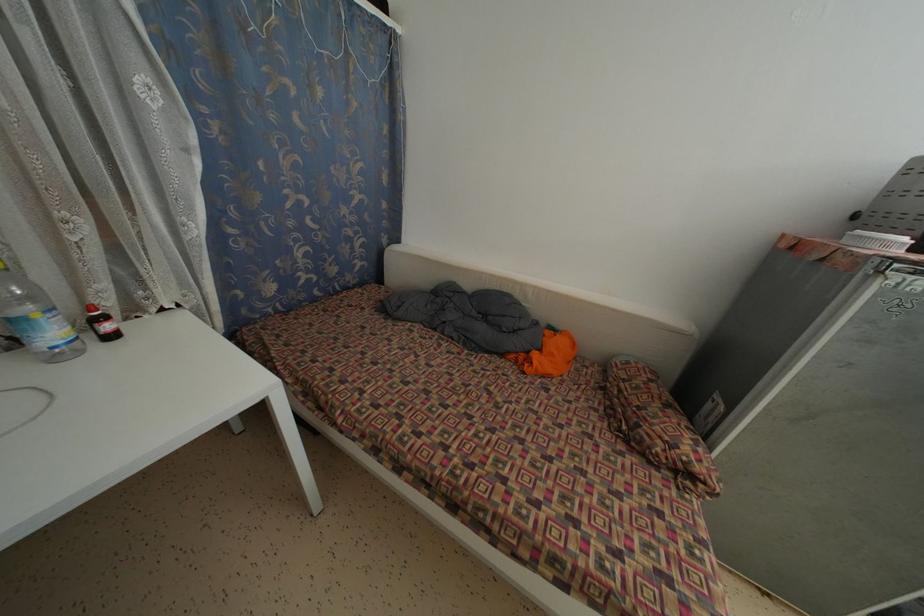
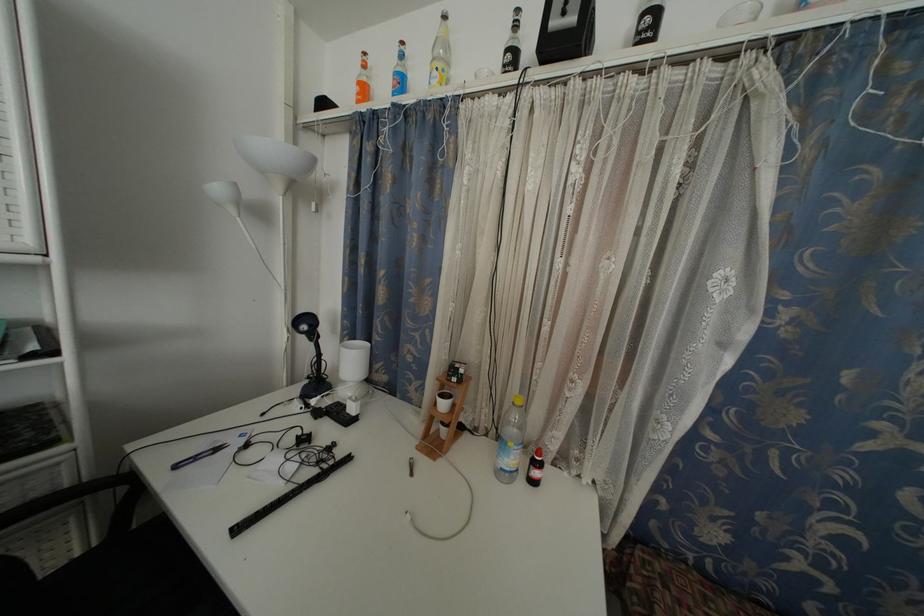
Question: Based on the continuous images, in which direction is the camera rotating? Reply with the corresponding letter.

Choices:
 (A) Left
 (B) Right
 (C) Up
 (D) Down

Answer: (A)